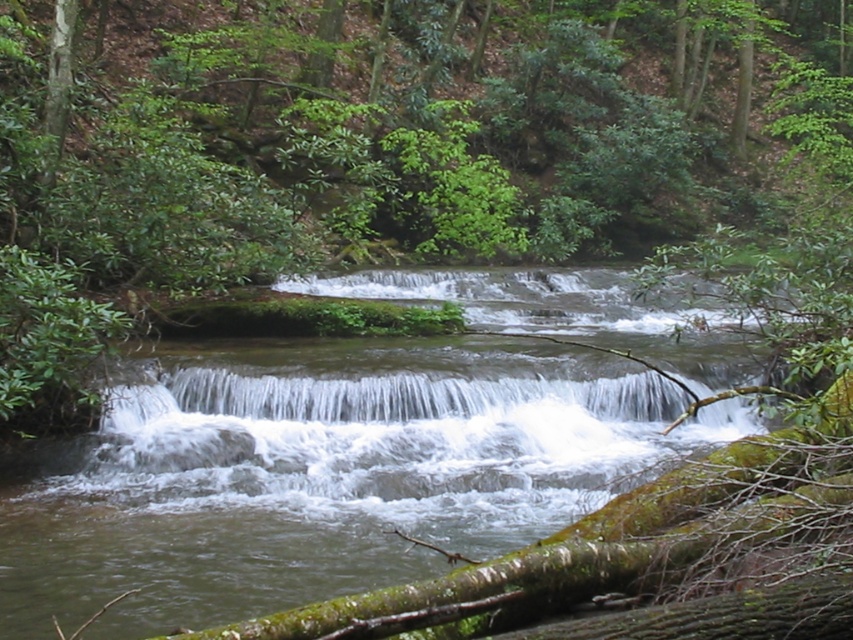
You are a hiker who wants to cross the stream at the center of the image. There is a point marked at coordinates point (323, 472) which is clear water at center. Can you safely cross the stream at this point?

The point (323, 472) marks clear water at center, so yes, you can safely cross the stream at this point since the water is clear and likely shallow enough for safe passage.

You are a hiker who wants to cross the stream. You see clear water at center and white frothy water at center. Which part of the stream should you avoid stepping into to ensure safety?

You should avoid stepping into the white frothy water at center because it occupies more space and may indicate stronger currents or deeper water, making it less safe compared to the clear water at center which has less space and likely calmer conditions.